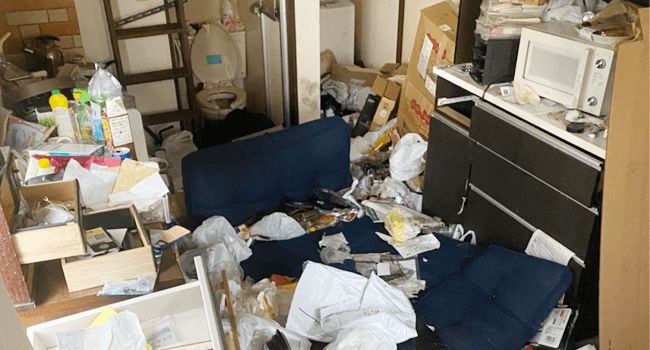
This screenshot has height=350, width=650. I want to click on handle for a drawer, so click(229, 313).